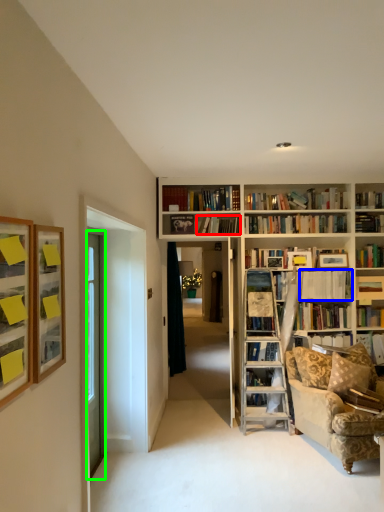
Question: Estimate the real-world distances between objects in this image. Which object is closer to book (highlighted by a red box), book (highlighted by a blue box) or door (highlighted by a green box)?

Choices:
 (A) book
 (B) door

Answer: (A)